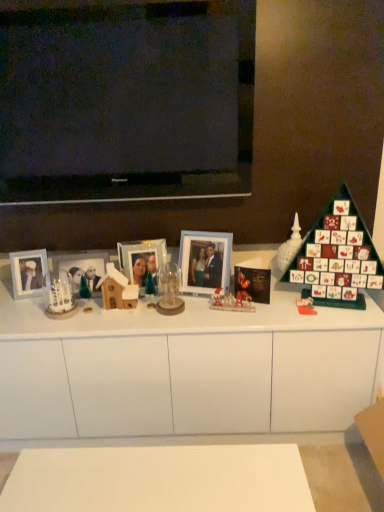
Identify the location of free point to the right of translucent plastic figurines at center, placed as the third toy when sorted from right to left. click(270, 308).